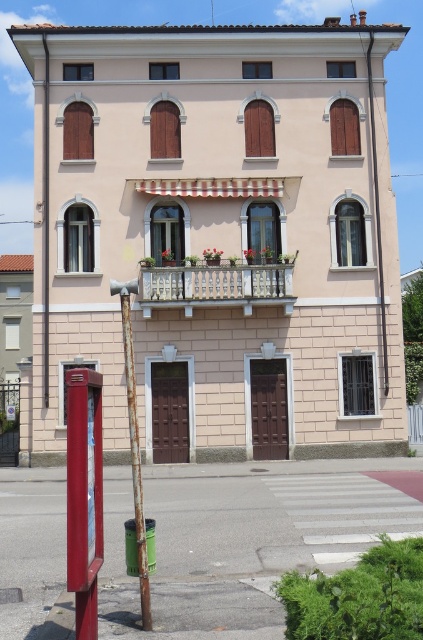
You are a window installer assessing the building. You need to replace the white wood shutter at left and the wooden at upper right. Which shutter requires a taller replacement? Please provide the answer based on the scene description.

The white wood shutter at left requires a taller replacement because it is taller than the wooden at upper right as per the description.

You are standing at the entrance of the building and want to make a phone call. Where should you go to find the metallic red phone box at lower left?

The metallic red phone box at lower left is located at point (84, 496), so you should go to that coordinate to find it.

You are a window cleaner standing on the ground floor of the residential building. You need to clean the white wood shutter at left and the wooden at upper right. Which object should you tackle first based on their positions?

The white wood shutter at left should be cleaned first because it is located below the wooden at upper right, making it more accessible from the ground floor.